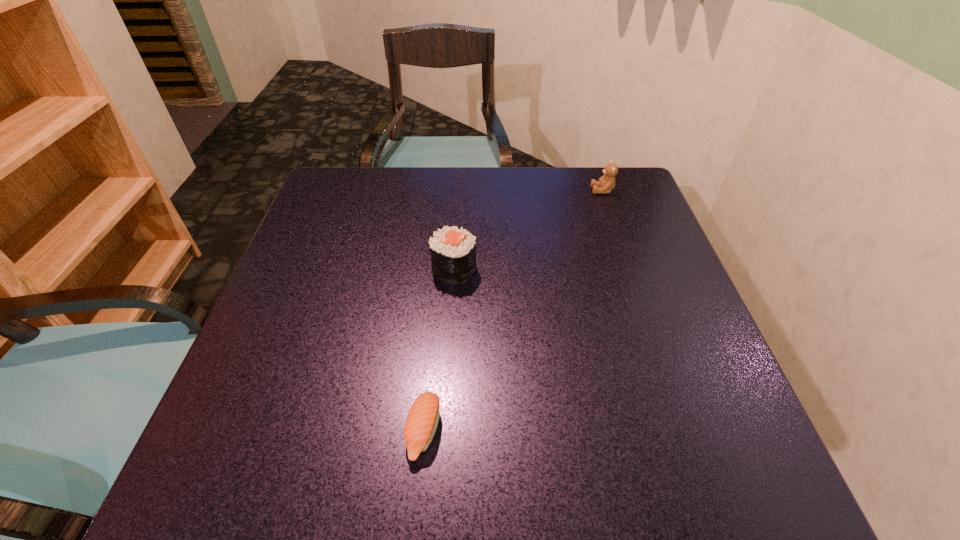
At what (x,y) coordinates should I click in order to perform the action: click on the taller sushi. Please return your answer as a coordinate pair (x, y). Looking at the image, I should click on (453, 251).

Identify the location of the second nearest object. (453, 251).

This screenshot has height=540, width=960. Find the location of `the farthest object`. the farthest object is located at coordinates (606, 183).

Identify the location of teddy bear. (606, 183).

Where is `the shorter sushi`? This screenshot has height=540, width=960. the shorter sushi is located at coordinates (422, 420).

At what (x,y) coordinates should I click in order to perform the action: click on the shortest object. Please return your answer as a coordinate pair (x, y). Image resolution: width=960 pixels, height=540 pixels. Looking at the image, I should click on (422, 420).

Locate an element on the screen. This screenshot has height=540, width=960. vacant space located 0.070m on the back of the farther sushi is located at coordinates (456, 234).

Image resolution: width=960 pixels, height=540 pixels. I want to click on free space located 0.280m on the front-facing side of the teddy bear, so click(488, 191).

Where is `vacant space located on the front-facing side of the teddy bear`? Image resolution: width=960 pixels, height=540 pixels. vacant space located on the front-facing side of the teddy bear is located at coordinates (517, 191).

Where is `blank area located on the front-facing side of the teddy bear`? blank area located on the front-facing side of the teddy bear is located at coordinates (543, 191).